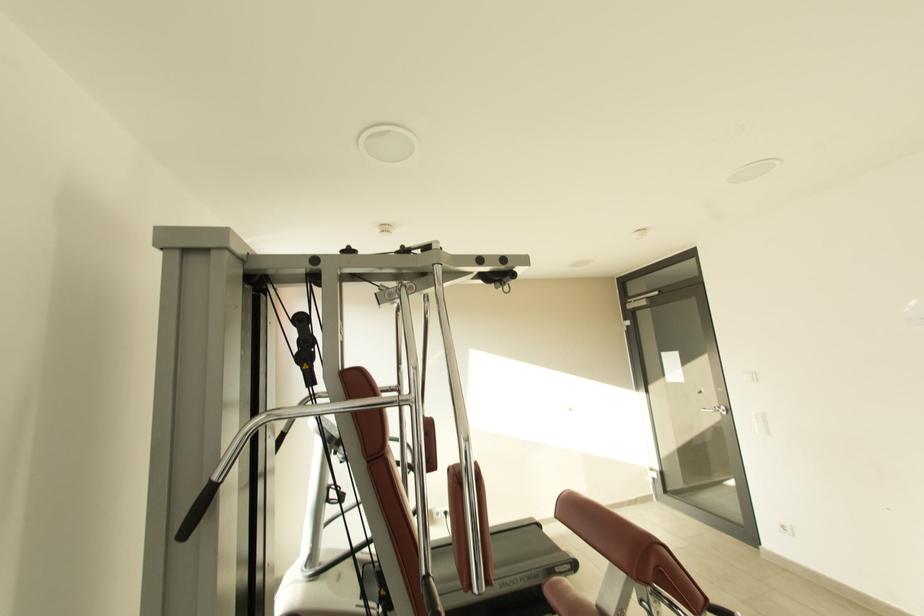
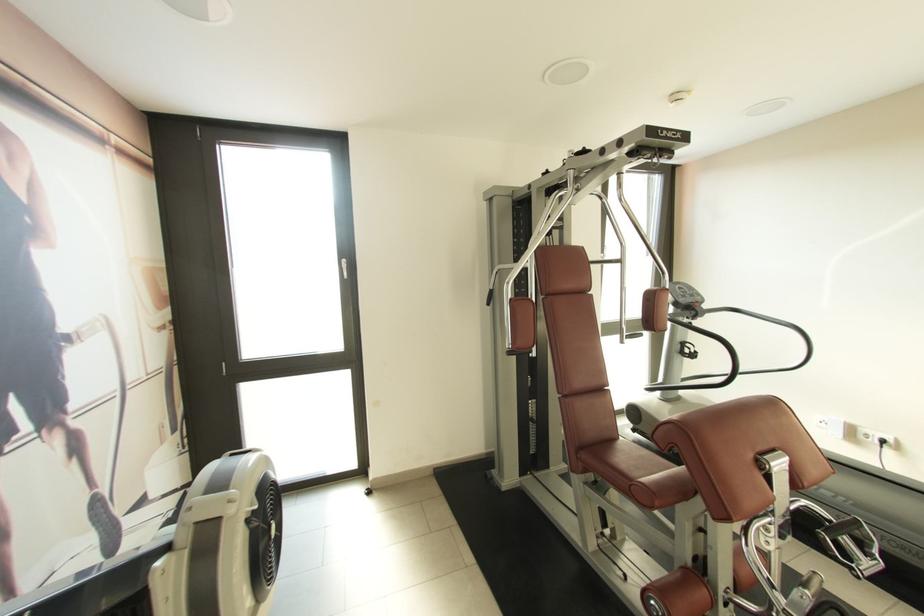
In the second image, find the point that corresponds to point (448, 516) in the first image.

(882, 445)